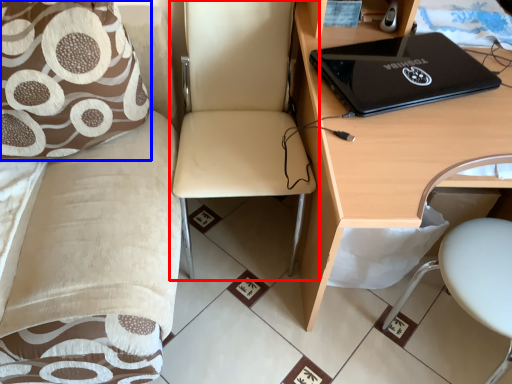
Question: Which of the following is the farthest to the observer, chair (highlighted by a red box) or pillow (highlighted by a blue box)?

Choices:
 (A) chair
 (B) pillow

Answer: (B)